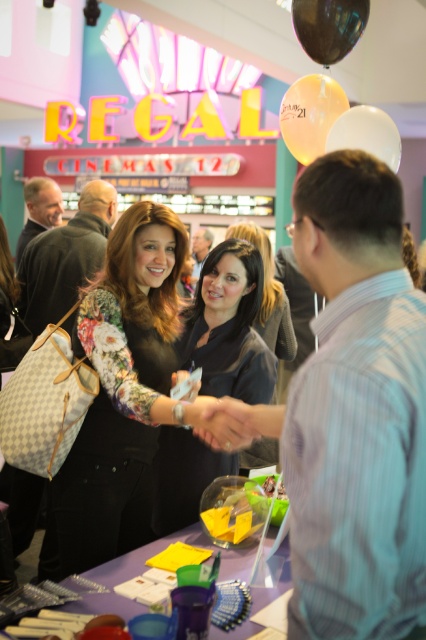
Is dark brown leather jacket at center above dark brown hair at center?

No.

Who is positioned more to the right, dark brown leather jacket at center or dark brown hair at center?

dark brown hair at center

Is point (226, 340) positioned after point (285, 333)?

No, (226, 340) is closer to viewer.

Identify the location of dark brown leather jacket at center. (229, 326).

Is point (149, 371) more distant than point (397, 150)?

No, (149, 371) is in front of (397, 150).

Describe the element at coordinates (120, 394) in the screenshot. The image size is (426, 640). I see `floral-patterned fabric at center` at that location.

Find the location of a particular element. The height and width of the screenshot is (640, 426). floral-patterned fabric at center is located at coordinates (120, 394).

Measure the distance between point [146,547] and camera.

The distance of point [146,547] from camera is 6.14 feet.

Can you confirm if purple plastic table at center is taller than translucent white balloon at upper center?

In fact, purple plastic table at center may be shorter than translucent white balloon at upper center.

Who is more forward, (239, 548) or (310, 77)?

Point (239, 548) is in front.

I want to click on purple plastic table at center, so click(x=131, y=573).